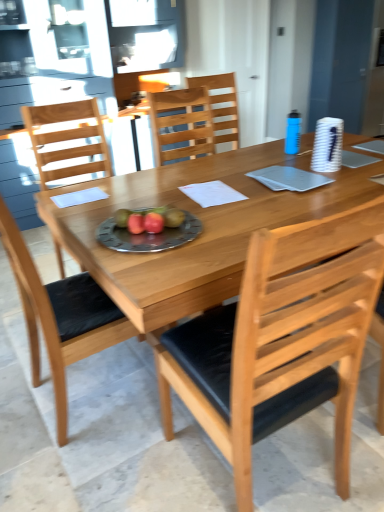
At what (x,y) coordinates should I click in order to perform the action: click on vacant space in front of red matte apple at center, placed as the 1th fruit when sorted from right to left. Please return your answer as a coordinate pair (x, y). Looking at the image, I should click on (150, 251).